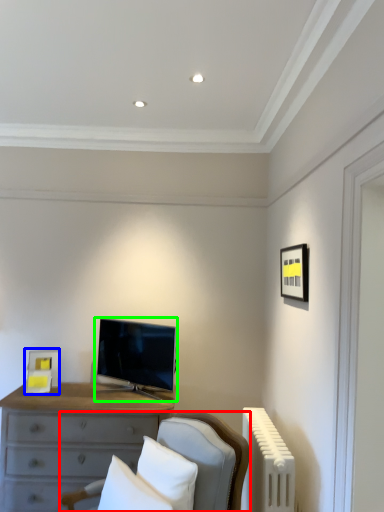
Question: Based on their relative distances, which object is farther from furniture (highlighted by a red box)? Choose from picture frame (highlighted by a blue box) and television (highlighted by a green box).

Choices:
 (A) picture frame
 (B) television

Answer: (A)